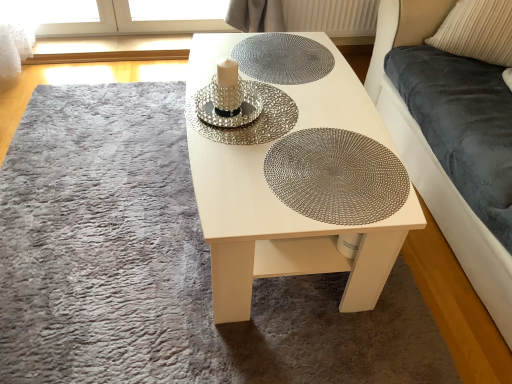
Image resolution: width=512 pixels, height=384 pixels. Identify the location of empty space that is ontop of metallic woven placemat at center, placed as the third glass plate when sorted from top to bottom (from a real-world perspective). (328, 166).